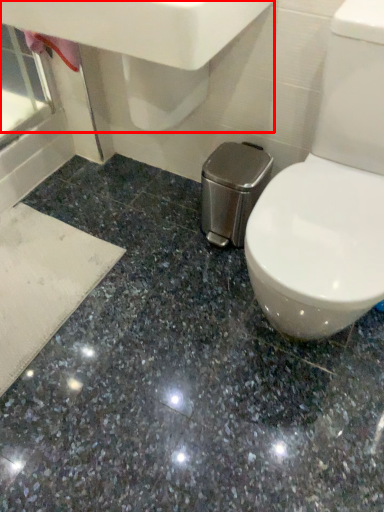
Question: Where is sink (annotated by the red box) located in relation to granite in the image?

Choices:
 (A) left
 (B) right

Answer: (A)